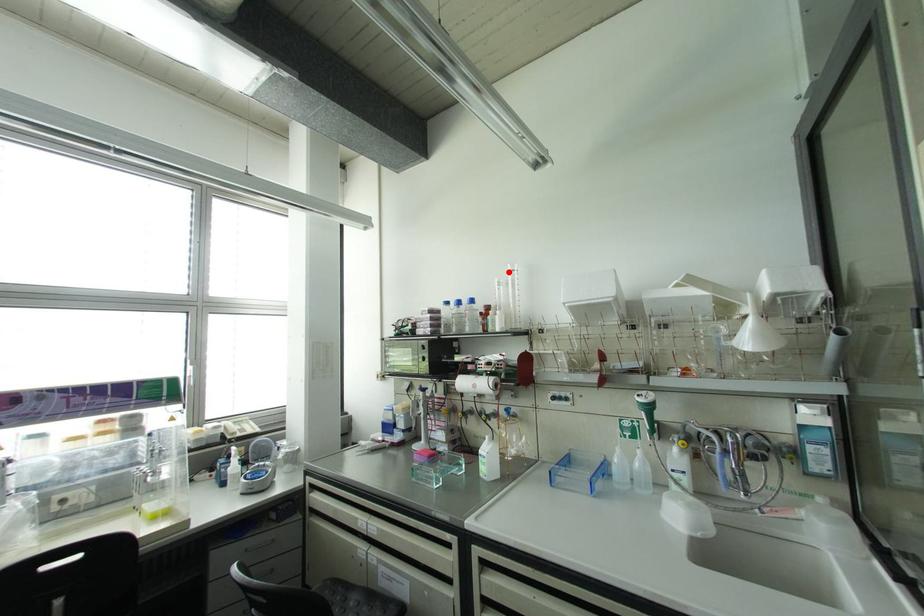
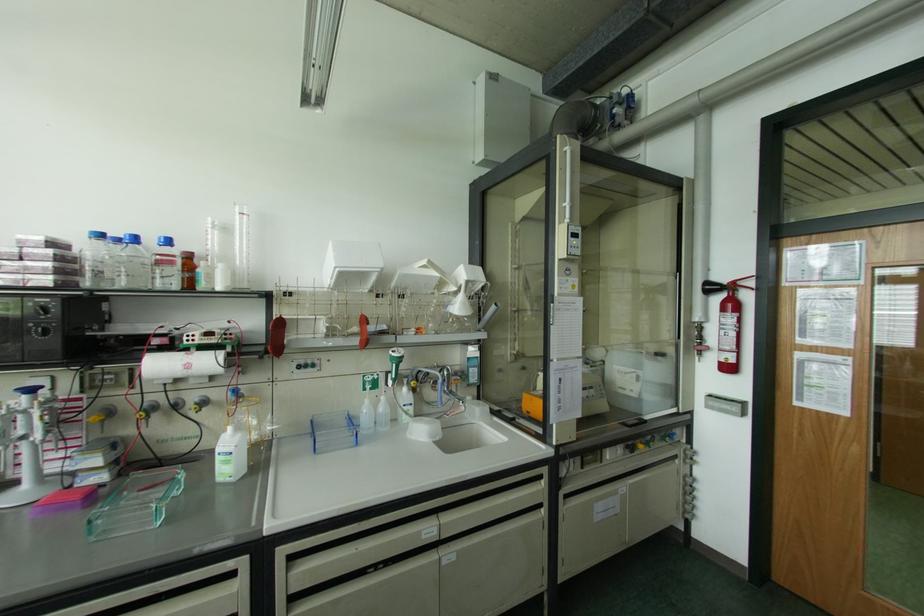
Find the pixel in the second image that matches the highlighted location in the first image.

(237, 216)